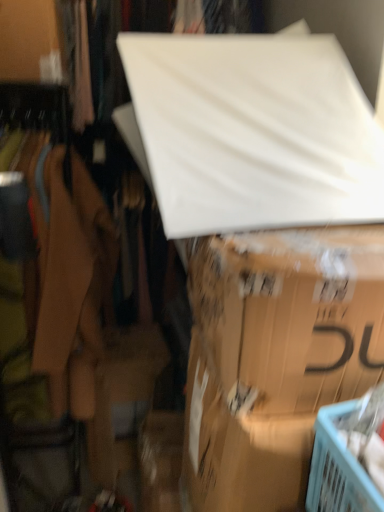
Question: Looking at the image, does white matte board at upper center seem bigger or smaller compared to matte cardboard box at center?

Choices:
 (A) small
 (B) big

Answer: (B)

Question: In the image, is white matte board at upper center positioned in front of or behind matte cardboard box at center?

Choices:
 (A) front
 (B) behind

Answer: (B)

Question: Which object is positioned farthest from the white matte board at upper center?

Choices:
 (A) matte cardboard box at center
 (B) white matte board at upper center

Answer: (B)

Question: Considering the real-world distances, which object is closest to the matte cardboard box at center?

Choices:
 (A) white matte board at upper center
 (B) white matte board at upper center

Answer: (B)